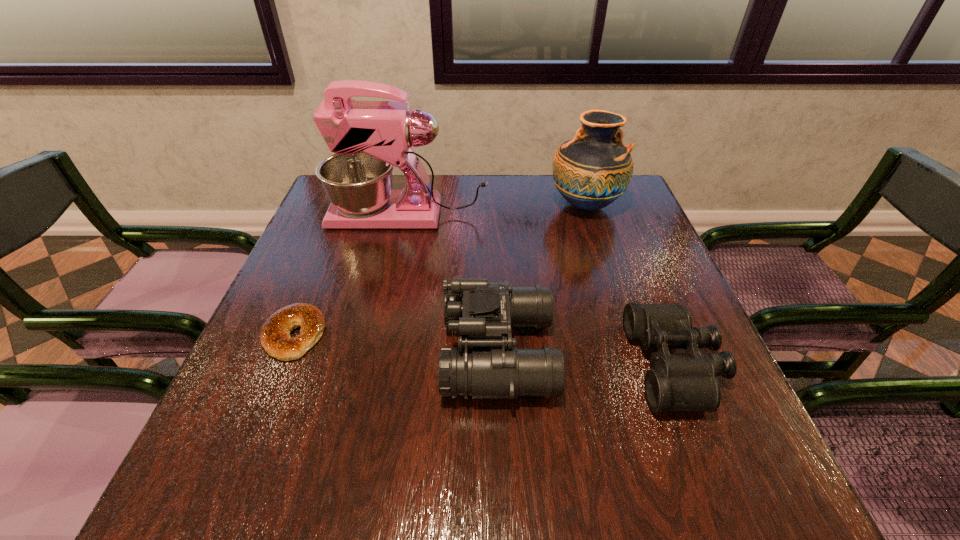
The width and height of the screenshot is (960, 540). Find the location of `free space that is in between the fourth shortest object and the taller binoculars`. free space that is in between the fourth shortest object and the taller binoculars is located at coordinates (541, 279).

This screenshot has height=540, width=960. Find the location of `vacant area that lies between the pottery and the mixer`. vacant area that lies between the pottery and the mixer is located at coordinates (496, 210).

This screenshot has height=540, width=960. I want to click on empty space between the pottery and the mixer, so click(x=496, y=210).

Find the location of a particular element. The width and height of the screenshot is (960, 540). unoccupied position between the fourth shortest object and the bagel is located at coordinates (440, 271).

Select which object is the third closest to the right binoculars. Please provide its 2D coordinates. Your answer should be formatted as a tuple, i.e. [(x, y)], where the tuple contains the x and y coordinates of a point satisfying the conditions above.

[(368, 138)]

Identify the location of object that stands as the second closest to the fourth tallest object. The image size is (960, 540). (591, 171).

The width and height of the screenshot is (960, 540). What are the coordinates of `free space that satisfies the following two spatial constraints: 1. on the front side of the fourth shortest object; 2. on the face of the mixer` in the screenshot? It's located at (588, 215).

Locate an element on the screen. The image size is (960, 540). vacant region that satisfies the following two spatial constraints: 1. on the face of the tallest object; 2. on the front side of the bagel is located at coordinates (383, 335).